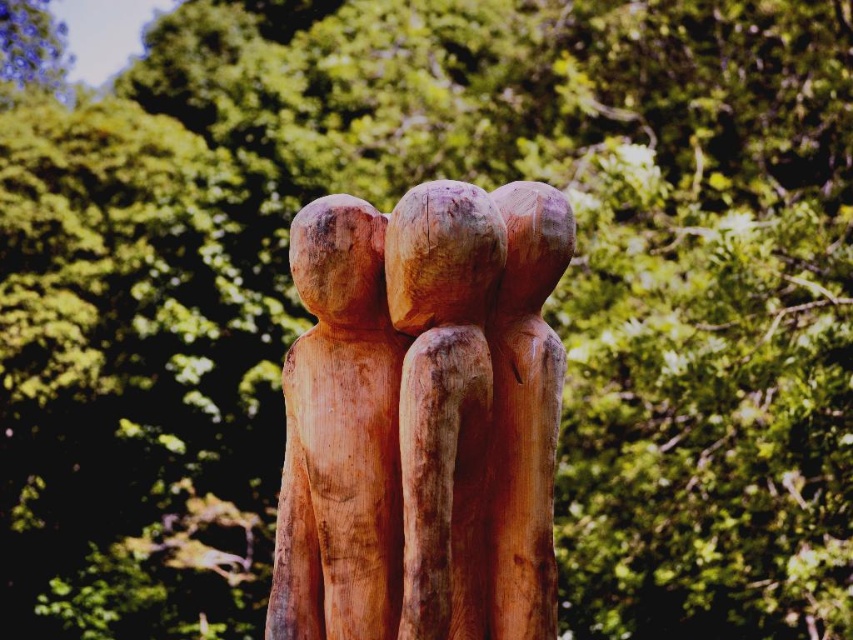
From the picture: You are a photographer trying to capture the three figures in the sculpture. You notice two points marked on your camera screen at coordinates point (508, 257) and point (367, 280). Which point is closer to the camera?

Point (508, 257) is in front of point (367, 280), so it is closer to the camera.

You are a photographer planning to take a photo of the natural wood sculpture at center and the natural wood figure at center. Since you want both subjects to be in focus, you need to know their positions relative to each other. According to the scene, which one is positioned to the right?

The natural wood sculpture at center is to the right of the natural wood figure at center.